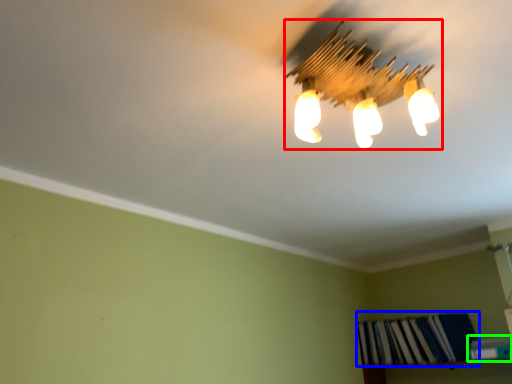
Question: Based on their relative distances, which object is farther from lamp (highlighted by a red box)? Choose from book (highlighted by a blue box) and book (highlighted by a green box).

Choices:
 (A) book
 (B) book

Answer: (A)